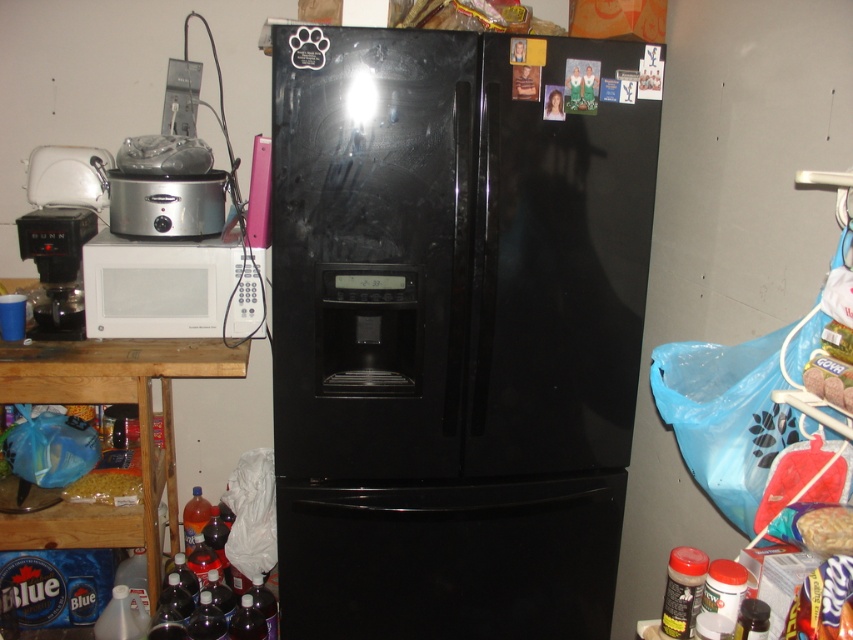
You are trying to determine if the black glossy refrigerator at center will fit through a doorway that is the same height as the smooth plastic bag at lower right. Can it pass through?

The black glossy refrigerator at center is taller than the smooth plastic bag at lower right, so it cannot pass through the doorway if the doorway is the same height as the smooth plastic bag at lower right.

You are organizing the kitchen and need to place a new spice jar between the black glossy refrigerator at center and the matte yellow pasta at lower left. Based on their positions, which object should the spice jar be closer to?

The black glossy refrigerator at center is to the right of the matte yellow pasta at lower left, so the spice jar should be placed closer to the matte yellow pasta at lower left since it is positioned to the left side of the refrigerator.

You are a delivery person who needs to place a new 12 inch box between the black glossy refrigerator at center and the matte yellow pasta at lower left. Can you fit the box in the space between them without moving either object?

The black glossy refrigerator at center and matte yellow pasta at lower left are 35.05 inches apart. Since the box is 12 inches long, there is enough space to fit it between them without moving either object.